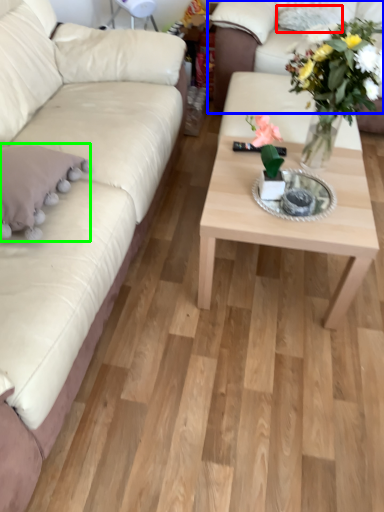
Question: Which object is positioned closest to pillow (highlighted by a red box)? Select from studio couch (highlighted by a blue box) and pillow (highlighted by a green box).

Choices:
 (A) studio couch
 (B) pillow

Answer: (A)